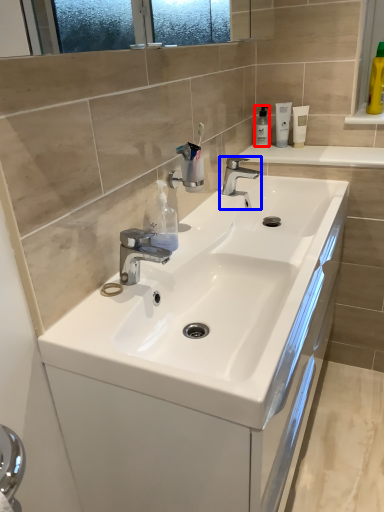
Question: Among these objects, which one is farthest to the camera, toiletry (highlighted by a red box) or tap (highlighted by a blue box)?

Choices:
 (A) toiletry
 (B) tap

Answer: (A)